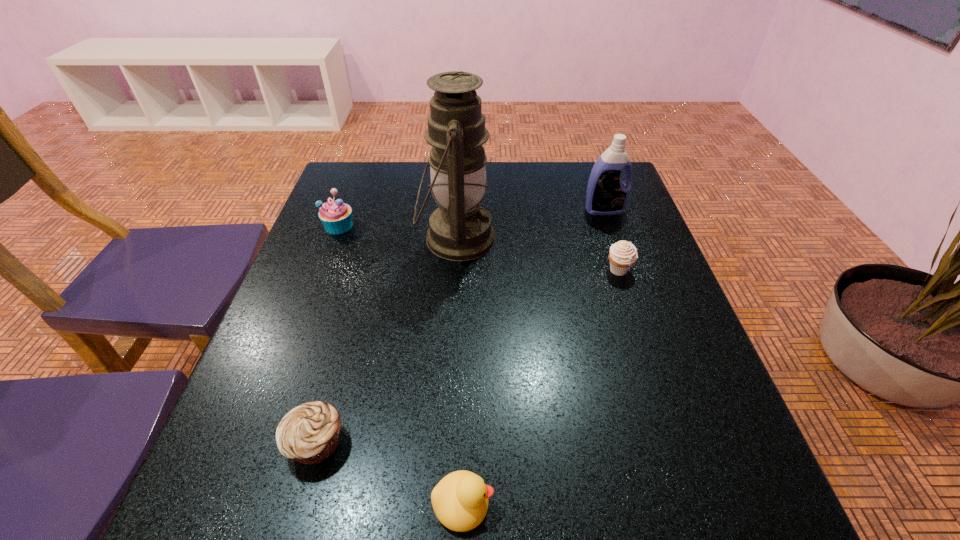
Identify the location of object at the far right corner. (607, 194).

Locate an element on the screen. free region at the far edge of the desktop is located at coordinates (540, 163).

In the image, there is a desktop. At what (x,y) coordinates should I click in order to perform the action: click on free space at the near edge. Please return your answer as a coordinate pair (x, y). Looking at the image, I should click on (387, 507).

Identify the location of free location at the left edge. This screenshot has width=960, height=540. (281, 374).

This screenshot has height=540, width=960. Identify the location of blank space at the right edge of the desktop. click(602, 223).

Find the location of a particular element. The height and width of the screenshot is (540, 960). vacant position at the far left corner of the desktop is located at coordinates (380, 201).

In order to click on free region at the near left corner of the desktop in this screenshot , I will do `click(307, 474)`.

I want to click on vacant area between the farthest muffin and the second muffin from right to left, so click(327, 334).

This screenshot has height=540, width=960. Find the location of `vacant point located between the rightmost muffin and the second muffin from left to right`. vacant point located between the rightmost muffin and the second muffin from left to right is located at coordinates (468, 356).

I want to click on free spot between the oil lamp and the duckling, so click(460, 371).